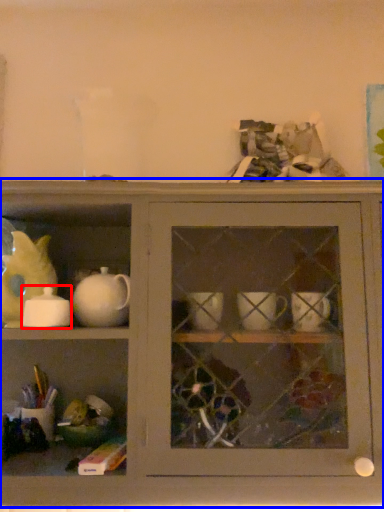
Question: Which point is further to the camera, tableware (highlighted by a red box) or shelf (highlighted by a blue box)?

Choices:
 (A) tableware
 (B) shelf

Answer: (A)